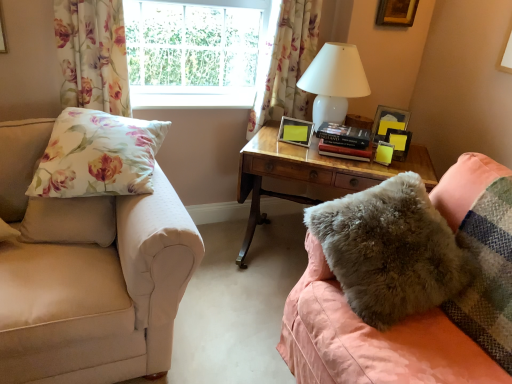
This screenshot has width=512, height=384. Identify the location of yellow matte picture frame at upper right, the third picture frame viewed from the right. (x=399, y=142).

Image resolution: width=512 pixels, height=384 pixels. What do you see at coordinates (295, 131) in the screenshot?
I see `matte wooden picture frame at center, the first picture frame from the left` at bounding box center [295, 131].

At what (x,y) coordinates should I click in order to perform the action: click on floral fabric curtain at upper left, which is counted as the second curtain, starting from the right. Please return your answer as a coordinate pair (x, y). Image resolution: width=512 pixels, height=384 pixels. Looking at the image, I should click on (92, 55).

This screenshot has height=384, width=512. What do you see at coordinates (288, 64) in the screenshot?
I see `floral fabric curtain at upper center, which is counted as the 1th curtain, starting from the right` at bounding box center [288, 64].

Identify the location of yellow matte picture frame at upper right, the 2th picture frame viewed from the left. This screenshot has width=512, height=384. (399, 142).

From a real-world perspective, which object stands above the other?

From a 3D spatial view, floral fabric curtain at upper left, which appears as the first curtain when viewed from the front, is above.

This screenshot has width=512, height=384. Find the location of `picture frame that is the 1st object to the right of the floral fabric curtain at upper left, which is counted as the second curtain, starting from the right, starting at the anchor`. picture frame that is the 1st object to the right of the floral fabric curtain at upper left, which is counted as the second curtain, starting from the right, starting at the anchor is located at coordinates [295, 131].

Considering the relative sizes of matte wooden picture frame at center, the first picture frame from the left, and floral fabric curtain at upper left, which is counted as the second curtain, starting from the right, in the image provided, is matte wooden picture frame at center, the first picture frame from the left, shorter than floral fabric curtain at upper left, which is counted as the second curtain, starting from the right,?

Indeed, matte wooden picture frame at center, the first picture frame from the left, has a lesser height compared to floral fabric curtain at upper left, which is counted as the second curtain, starting from the right.

Can you confirm if floral fabric curtain at upper left, which is the 1th curtain in left-to-right order, is taller than fuzzy gray pillow at lower right, which appears as the 1th pillow when viewed from the right?

Correct, floral fabric curtain at upper left, which is the 1th curtain in left-to-right order, is much taller as fuzzy gray pillow at lower right, which appears as the 1th pillow when viewed from the right.

From a real-world perspective, is floral fabric curtain at upper left, the 2th curtain viewed from the back, positioned above or below fuzzy gray pillow at lower right, which appears as the 1th pillow when viewed from the right?

In terms of real-world spatial position, floral fabric curtain at upper left, the 2th curtain viewed from the back, is above fuzzy gray pillow at lower right, which appears as the 1th pillow when viewed from the right.

Which is closer, (63,54) or (354,234)?

The point (354,234) is more forward.

Looking at this image, is floral fabric curtain at upper left, which appears as the first curtain when viewed from the front, in front of or behind fuzzy gray pillow at lower right, which appears as the 1th pillow when viewed from the right, in the image?

floral fabric curtain at upper left, which appears as the first curtain when viewed from the front, is behind fuzzy gray pillow at lower right, which appears as the 1th pillow when viewed from the right.

Could you tell me if hardcover book at center is facing clear glass window at upper center?

No, hardcover book at center is not turned towards clear glass window at upper center.

How distant is hardcover book at center from clear glass window at upper center?

A distance of 33.67 inches exists between hardcover book at center and clear glass window at upper center.

Which object is more forward, hardcover book at center or clear glass window at upper center?

hardcover book at center is in front.

From the picture: Is yellow matte picture frame at upper right, which is the 4th picture frame from top to bottom, behind matte black picture frame at upper right, which is the 3th picture frame in bottom-to-top order?

No, yellow matte picture frame at upper right, which is the 4th picture frame from top to bottom, is in front of matte black picture frame at upper right, which is the 3th picture frame in bottom-to-top order.

The image size is (512, 384). What are the coordinates of `the 1st picture frame to the left when counting from the matte black picture frame at upper right, which is the second picture frame from top to bottom` in the screenshot? It's located at (399, 142).

Is point (401, 155) closer or farther from the camera than point (382, 121)?

Point (401, 155) is closer to the camera than point (382, 121).

Which of these two, yellow matte picture frame at upper right, the third picture frame viewed from the right, or matte black picture frame at upper right, which appears as the second picture frame when viewed from the right, stands shorter?

Standing shorter between the two is yellow matte picture frame at upper right, the third picture frame viewed from the right.

Does point (393, 135) lie in front of point (284, 89)?

Yes.

Is the position of yellow matte picture frame at upper right, the 2th picture frame viewed from the left, less distant than that of floral fabric curtain at upper center, the 2th curtain from the front?

Yes, the depth of yellow matte picture frame at upper right, the 2th picture frame viewed from the left, is less than that of floral fabric curtain at upper center, the 2th curtain from the front.

Is yellow matte picture frame at upper right, which is the 4th picture frame from top to bottom, not within floral fabric curtain at upper center, the 2th curtain from the front?

Yes, yellow matte picture frame at upper right, which is the 4th picture frame from top to bottom, is outside of floral fabric curtain at upper center, the 2th curtain from the front.

Is the depth of yellow matte picture frame at upper right, which is the 4th picture frame from top to bottom, greater than that of white glossy table lamp at upper right?

Yes, yellow matte picture frame at upper right, which is the 4th picture frame from top to bottom, is further from the viewer.

From the image's perspective, is yellow matte picture frame at upper right, the 2th picture frame viewed from the left, above or below white glossy table lamp at upper right?

yellow matte picture frame at upper right, the 2th picture frame viewed from the left, is situated lower than white glossy table lamp at upper right in the image.

Where is `table lamp that appears above the yellow matte picture frame at upper right, the third picture frame viewed from the right (from the image's perspective)`? This screenshot has width=512, height=384. table lamp that appears above the yellow matte picture frame at upper right, the third picture frame viewed from the right (from the image's perspective) is located at coordinates (334, 81).

Can you confirm if yellow matte picture frame at upper right, which is the 4th picture frame from top to bottom, is positioned to the right of white glossy table lamp at upper right?

Indeed, yellow matte picture frame at upper right, which is the 4th picture frame from top to bottom, is positioned on the right side of white glossy table lamp at upper right.

Considering the relative sizes of floral fabric pillow at left, placed as the 2th pillow when sorted from right to left, and floral fabric curtain at upper left, the 2th curtain viewed from the back, in the image provided, is floral fabric pillow at left, placed as the 2th pillow when sorted from right to left, thinner than floral fabric curtain at upper left, the 2th curtain viewed from the back,?

Incorrect, the width of floral fabric pillow at left, placed as the 2th pillow when sorted from right to left, is not less than that of floral fabric curtain at upper left, the 2th curtain viewed from the back.

Relative to floral fabric curtain at upper left, which is the 1th curtain in left-to-right order, is floral fabric pillow at left, the 1th pillow when ordered from left to right, in front or behind?

floral fabric pillow at left, the 1th pillow when ordered from left to right, is positioned closer to the viewer than floral fabric curtain at upper left, which is the 1th curtain in left-to-right order.

From a real-world perspective, is floral fabric pillow at left, placed as the 2th pillow when sorted from right to left, physically located above or below floral fabric curtain at upper left, which appears as the first curtain when viewed from the front?

floral fabric pillow at left, placed as the 2th pillow when sorted from right to left, is situated lower than floral fabric curtain at upper left, which appears as the first curtain when viewed from the front, in the real world.

From the picture: Based on their sizes in the image, would you say floral fabric pillow at left, the 1th pillow when ordered from left to right, is bigger or smaller than floral fabric curtain at upper left, which appears as the first curtain when viewed from the front?

Answer: Clearly, floral fabric pillow at left, the 1th pillow when ordered from left to right, is larger in size than floral fabric curtain at upper left, which appears as the first curtain when viewed from the front.

From a real-world perspective, count 2nd curtains upward from the matte wooden picture frame at center, the first picture frame from the left, and point to it. Please provide its 2D coordinates.

[(92, 55)]

Identify the location of pillow that is the 2nd object located below the floral fabric curtain at upper left, which appears as the first curtain when viewed from the front (from the image's perspective). (391, 250).

Considering their positions, is beige fabric couch at left positioned further to wooden desk at center than white glossy table lamp at upper right?

beige fabric couch at left is positioned further to the anchor wooden desk at center.

Estimate the real-world distances between objects in this image. Which object is closer to beige fabric couch at left, floral fabric curtain at upper center, which is counted as the 1th curtain, starting from the right, or yellow matte picture frame at upper right, marked as the first picture frame in a bottom-to-top arrangement?

Based on the image, floral fabric curtain at upper center, which is counted as the 1th curtain, starting from the right, appears to be nearer to beige fabric couch at left.

From the image, which object appears to be farther from yellow matte picture frame at upper right, marked as the first picture frame in a bottom-to-top arrangement, clear glass window at upper center or matte wooden picture frame at center, acting as the 2th picture frame starting from the bottom?

clear glass window at upper center lies further to yellow matte picture frame at upper right, marked as the first picture frame in a bottom-to-top arrangement, than the other object.

Based on their spatial positions, is fuzzy gray pillow at lower right, which appears as the 1th pillow when viewed from the right, or beige fabric couch at left further from wooden picture frame at upper right, placed as the fourth picture frame when sorted from bottom to top?

beige fabric couch at left is positioned further to the anchor wooden picture frame at upper right, placed as the fourth picture frame when sorted from bottom to top.

Which object lies nearer to the anchor point floral fabric curtain at upper center, the 1th curtain positioned from the back, hardcover book at center or matte wooden picture frame at center, which is the third picture frame from top to bottom?

matte wooden picture frame at center, which is the third picture frame from top to bottom, is closer to floral fabric curtain at upper center, the 1th curtain positioned from the back.

Considering their positions, is matte wooden picture frame at center, which is the 4th picture frame from right to left, positioned closer to matte black picture frame at upper right, which is the 3th picture frame in bottom-to-top order, than floral fabric curtain at upper center, the 2th curtain from the front?

Among the two, matte wooden picture frame at center, which is the 4th picture frame from right to left, is located nearer to matte black picture frame at upper right, which is the 3th picture frame in bottom-to-top order.

Looking at the image, which one is located further to fuzzy gray pillow at lower right, the 2th pillow in the left-to-right sequence, white glossy table lamp at upper right or clear glass window at upper center?

Based on the image, clear glass window at upper center appears to be further to fuzzy gray pillow at lower right, the 2th pillow in the left-to-right sequence.

When comparing their distances from beige fabric couch at left, does clear glass window at upper center or floral fabric curtain at upper center, the 1th curtain positioned from the back, seem further?

floral fabric curtain at upper center, the 1th curtain positioned from the back, is further to beige fabric couch at left.

Where is `book between matte black picture frame at upper right, which is the second picture frame from top to bottom, and wooden desk at center vertically`? book between matte black picture frame at upper right, which is the second picture frame from top to bottom, and wooden desk at center vertically is located at coordinates (344, 142).

I want to click on nightstand between beige fabric couch at left and clear glass window at upper center from front to back, so click(309, 173).

You are a GUI agent. You are given a task and a screenshot of the screen. Output one action in this format:
    pyautogui.click(x=<x>, y=<y>)
    Task: Click on the table lamp between floral fabric curtain at upper center, the 1th curtain positioned from the back, and wooden picture frame at upper right, placed as the fourth picture frame when sorted from bottom to top, from left to right
    
    Given the screenshot: What is the action you would take?
    pos(334,81)

The image size is (512, 384). In order to click on curtain situated between floral fabric curtain at upper left, which is counted as the second curtain, starting from the right, and matte black picture frame at upper right, which is the 3th picture frame in bottom-to-top order, from left to right in this screenshot , I will do `click(288, 64)`.